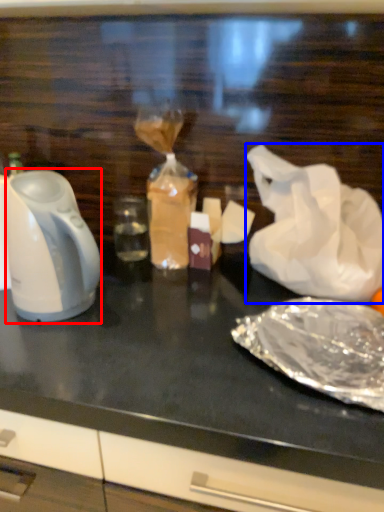
Question: Among these objects, which one is nearest to the camera, kettle (highlighted by a red box) or plastic bag (highlighted by a blue box)?

Choices:
 (A) kettle
 (B) plastic bag

Answer: (A)